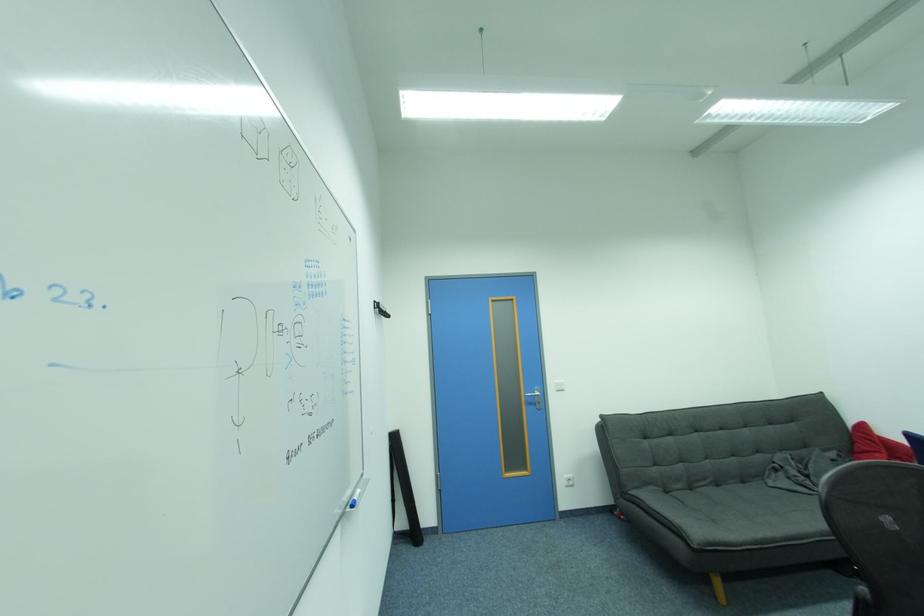
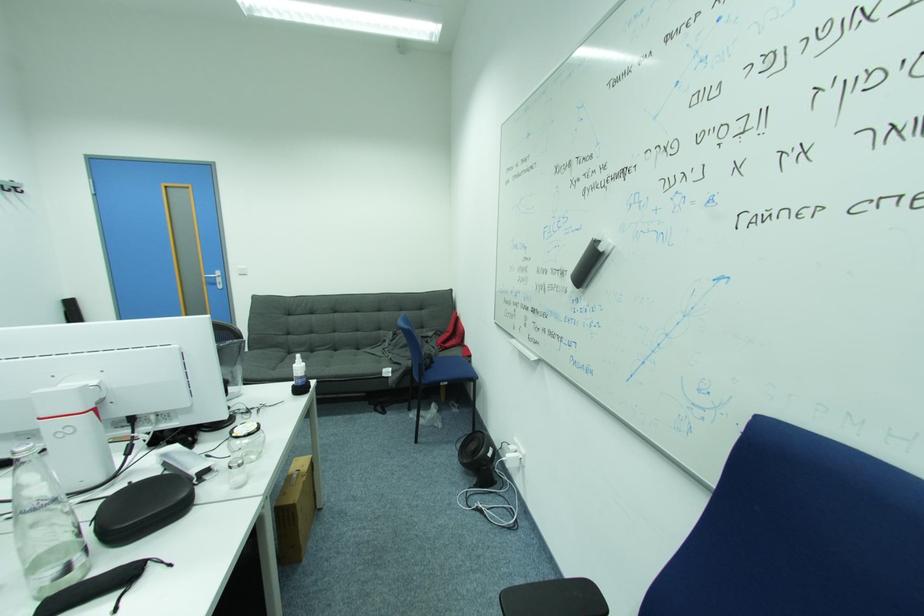
Question: The images are taken continuously from a first-person perspective. In which direction are you moving?

Choices:
 (A) Left
 (B) Right
 (C) Forward
 (D) Backward

Answer: (B)